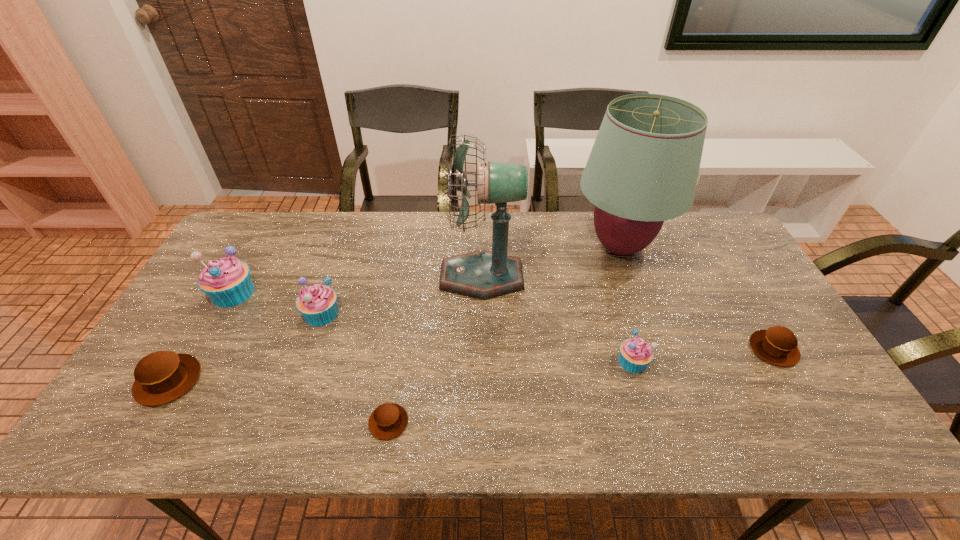
At what (x,y) coordinates should I click in order to perform the action: click on brown muffin that is the closest to the biggest brown muffin. Please return your answer as a coordinate pair (x, y). The image size is (960, 540). Looking at the image, I should click on (389, 420).

You are a GUI agent. You are given a task and a screenshot of the screen. Output one action in this format:
    pyautogui.click(x=<x>, y=<y>)
    Task: Click on the free space in the image that satisfies the following two spatial constraints: 1. on the front side of the leftmost blue muffin; 2. on the right side of the rightmost object
    Image resolution: width=960 pixels, height=540 pixels.
    Given the screenshot: What is the action you would take?
    pyautogui.click(x=202, y=349)

The width and height of the screenshot is (960, 540). Find the location of `blank area in the image that satisfies the following two spatial constraints: 1. on the front side of the leftmost blue muffin; 2. on the left side of the smallest brown muffin`. blank area in the image that satisfies the following two spatial constraints: 1. on the front side of the leftmost blue muffin; 2. on the left side of the smallest brown muffin is located at coordinates (160, 422).

I want to click on free space that satisfies the following two spatial constraints: 1. in front of the blue fan where the wind blows; 2. on the front side of the third muffin from left to right, so click(482, 313).

This screenshot has height=540, width=960. I want to click on vacant point that satisfies the following two spatial constraints: 1. on the back side of the biggest brown muffin; 2. on the right side of the sixth shortest object, so click(220, 293).